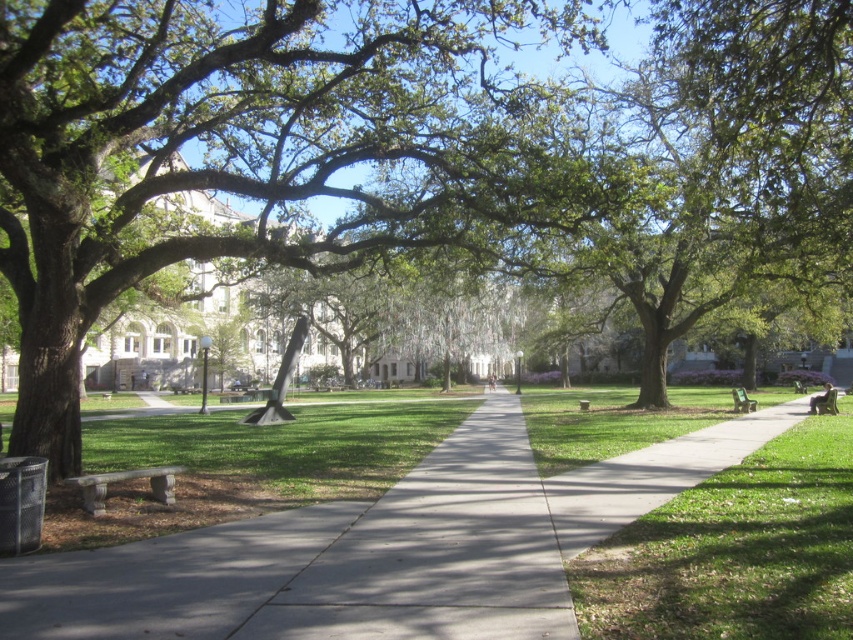
You are standing at the starting point of the pathway in the park. You notice a gray concrete sidewalk at center located at point (439, 552). If you walk straight ahead along the pathway, will you eventually reach the gray concrete sidewalk at center?

Yes, because the gray concrete sidewalk at center is located at point (439, 552) along the pathway, so walking straight ahead will lead you directly to it.

You are a person sitting on the green wooden bench at right. You want to walk to the gray concrete sidewalk at center. Which direction should you move relative to the bench?

The gray concrete sidewalk at center is above the green wooden bench at right, so you should move upward from the bench to reach it.